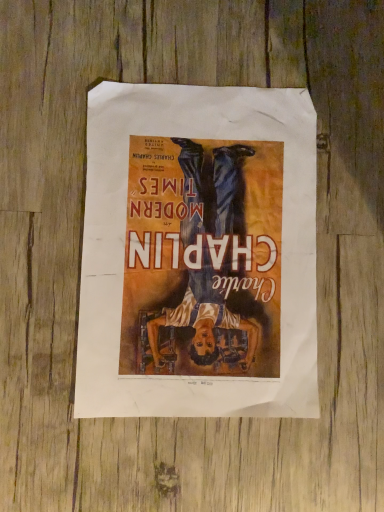
Measure the distance between matte paper poster at center and camera.

They are 14.12 inches apart.

What is the approximate height of matte paper poster at center?

The height of matte paper poster at center is 0.39 inches.

Describe the element at coordinates (198, 253) in the screenshot. I see `matte paper poster at center` at that location.

What is the approximate width of matte paper poster at center?

matte paper poster at center is 11.87 inches in width.

The image size is (384, 512). What are the coordinates of `matte paper poster at center` in the screenshot? It's located at (198, 253).

This screenshot has width=384, height=512. What are the coordinates of `matte paper poster at center` in the screenshot? It's located at (198, 253).